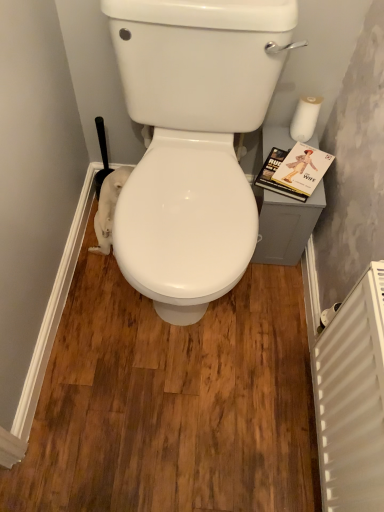
Question: Looking at the image, does hardcover book at right seem bigger or smaller compared to white matte toilet paper at upper right, which is the 1th toilet paper in right-to-left order?

Choices:
 (A) big
 (B) small

Answer: (A)

Question: Is point (281, 176) closer or farther from the camera than point (301, 137)?

Choices:
 (A) farther
 (B) closer

Answer: (B)

Question: Which object is the farthest from the white matte toilet paper at upper right, placed as the first toilet paper when sorted from top to bottom?

Choices:
 (A) white plastic radiator at lower right
 (B) white matte toilet paper at lower right, placed as the second toilet paper when sorted from right to left
 (C) white glossy toilet at center
 (D) hardcover book at right

Answer: (A)

Question: Estimate the real-world distances between objects in this image. Which object is farther from the white matte toilet paper at lower right, placed as the second toilet paper when sorted from right to left?

Choices:
 (A) hardcover book at right
 (B) white glossy toilet at center
 (C) white matte toilet paper at upper right, which is the 1th toilet paper in right-to-left order
 (D) white plastic radiator at lower right

Answer: (D)